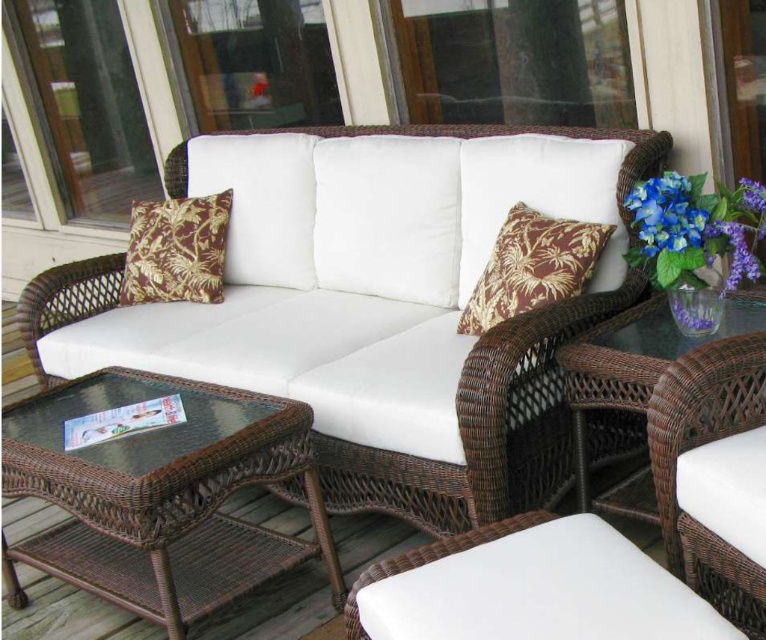
Who is more distant from viewer, [663,362] or [634,227]?

Point [634,227]

Does clear glass table at right appear on the right side of blue silk flowers at upper right?

In fact, clear glass table at right is to the left of blue silk flowers at upper right.

Locate an element on the screen. clear glass table at right is located at coordinates (634, 378).

Locate an element on the screen. The image size is (766, 640). clear glass table at right is located at coordinates (634, 378).

Is clear glass table at right positioned at the back of brown textured pillow at left?

No.

Who is more distant from viewer, [619,508] or [172,227]?

Positioned behind is point [172,227].

You are a GUI agent. You are given a task and a screenshot of the screen. Output one action in this format:
    pyautogui.click(x=<x>, y=<y>)
    Task: Click on the clear glass table at right
    This screenshot has height=640, width=766.
    Given the screenshot: What is the action you would take?
    pyautogui.click(x=634, y=378)

Is point (663, 440) in front of point (614, 490)?

Yes.

Who is positioned more to the right, brown wicker armchair at lower right or clear glass table at right?

brown wicker armchair at lower right is more to the right.

This screenshot has height=640, width=766. Identify the location of brown wicker armchair at lower right. (702, 449).